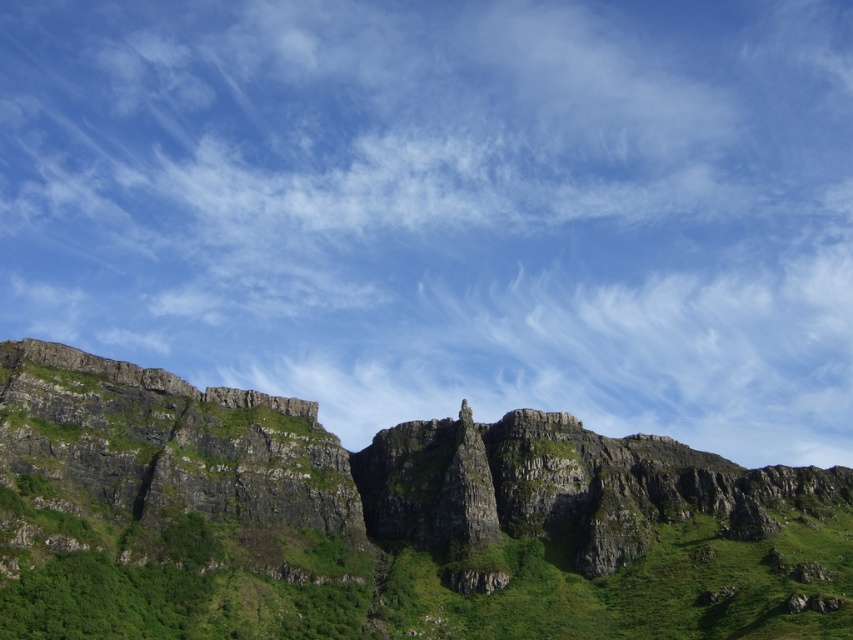
You are an astronomer analyzing the image of the cliffs. You need to determine the position of the white fluffy cloud at upper center in the image. What are its coordinates?

The white fluffy cloud at upper center is located at coordinates 0.325 in the x axis and 0.525 in the y axis.

You are a hiker standing at point A and want to reach point B. The coordinates of point A are point (747, 108) and point B are point (198, 499). According to the image, which direction should you move to get from point A to point B?

Point (747, 108) is behind point (198, 499), so to move from point A to point B, you should move forward towards the direction of point B.